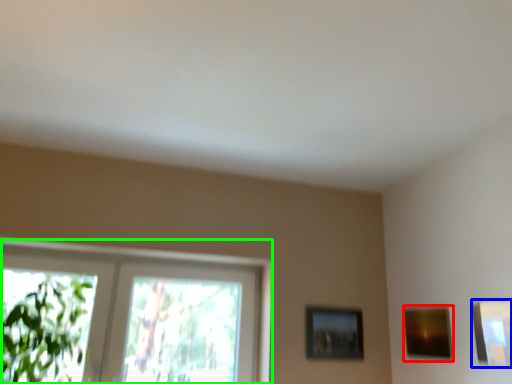
Question: Which is farther away from picture frame (highlighted by a red box)? picture frame (highlighted by a blue box) or window (highlighted by a green box)?

Choices:
 (A) picture frame
 (B) window

Answer: (B)